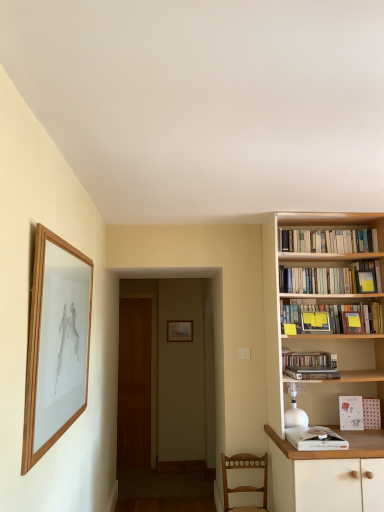
Question: From the image's perspective, would you say white paperbacks at upper right, the sixth book positioned from the bottom, is shown under hardcover books at upper right, the 5th book in the bottom-to-top sequence?

Choices:
 (A) yes
 (B) no

Answer: (B)

Question: Is white paperbacks at upper right, which appears as the first book when viewed from the top, not close to hardcover books at upper right, which is counted as the second book, starting from the top?

Choices:
 (A) yes
 (B) no

Answer: (B)

Question: Is white paperbacks at upper right, the sixth book positioned from the bottom, oriented towards hardcover books at upper right, the 5th book in the bottom-to-top sequence?

Choices:
 (A) no
 (B) yes

Answer: (A)

Question: Is hardcover books at upper right, which is counted as the second book, starting from the top, completely or partially inside white paperbacks at upper right, which appears as the first book when viewed from the top?

Choices:
 (A) yes
 (B) no

Answer: (B)

Question: Is white paperbacks at upper right, which appears as the first book when viewed from the top, further to camera compared to hardcover books at upper right, the 5th book in the bottom-to-top sequence?

Choices:
 (A) yes
 (B) no

Answer: (A)

Question: From a real-world perspective, is white paper book at lower right, which is counted as the first book, starting from the bottom, positioned above or below wooden bookshelf at right?

Choices:
 (A) above
 (B) below

Answer: (B)

Question: Looking at their shapes, would you say white paper book at lower right, which is counted as the first book, starting from the bottom, is wider or thinner than wooden bookshelf at right?

Choices:
 (A) thin
 (B) wide

Answer: (A)

Question: Does point (319, 438) appear closer or farther from the camera than point (370, 437)?

Choices:
 (A) farther
 (B) closer

Answer: (B)

Question: In terms of height, does white paper book at lower right, which is counted as the first book, starting from the bottom, look taller or shorter compared to wooden bookshelf at right?

Choices:
 (A) tall
 (B) short

Answer: (B)

Question: From the image's perspective, is wooden chair at lower right positioned above or below white paper book at lower right, which is counted as the first book, starting from the bottom?

Choices:
 (A) below
 (B) above

Answer: (A)

Question: In the image, is wooden chair at lower right positioned in front of or behind white paper book at lower right, which is the sixth book in top-to-bottom order?

Choices:
 (A) front
 (B) behind

Answer: (B)

Question: From their relative heights in the image, would you say wooden chair at lower right is taller or shorter than white paper book at lower right, which is the sixth book in top-to-bottom order?

Choices:
 (A) short
 (B) tall

Answer: (B)

Question: Considering the positions of wooden chair at lower right and white paper book at lower right, which is the sixth book in top-to-bottom order, in the image, is wooden chair at lower right bigger or smaller than white paper book at lower right, which is the sixth book in top-to-bottom order,?

Choices:
 (A) big
 (B) small

Answer: (A)

Question: From their relative heights in the image, would you say white glossy lamp at right is taller or shorter than matte wooden picture frame at center, the second picture frame from the top?

Choices:
 (A) short
 (B) tall

Answer: (B)

Question: In the image, is white glossy lamp at right positioned in front of or behind matte wooden picture frame at center, placed as the 1th picture frame when sorted from right to left?

Choices:
 (A) behind
 (B) front

Answer: (B)